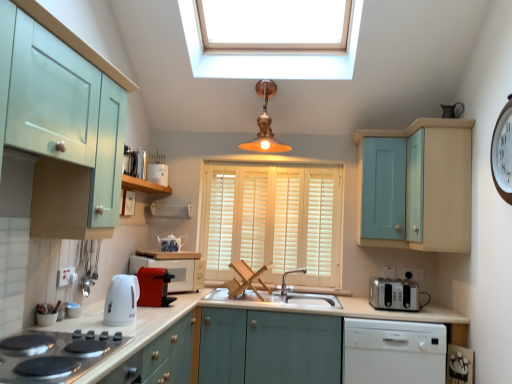
Question: Would you say white ceramic toaster at center, which appears as the second appliance when viewed from the left, is part of light blue wood cabinet at upper right, arranged as the first cabinetry when viewed from the right,'s contents?

Choices:
 (A) yes
 (B) no

Answer: (B)

Question: Considering the relative sizes of light blue wood cabinet at upper right, arranged as the first cabinetry when viewed from the right, and white ceramic toaster at center, the 3th appliance from the bottom, in the image provided, is light blue wood cabinet at upper right, arranged as the first cabinetry when viewed from the right, smaller than white ceramic toaster at center, the 3th appliance from the bottom,?

Choices:
 (A) yes
 (B) no

Answer: (B)

Question: Can you confirm if light blue wood cabinet at upper right, marked as the 3th cabinetry in a left-to-right arrangement, is bigger than white ceramic toaster at center, the 3th appliance from the bottom?

Choices:
 (A) no
 (B) yes

Answer: (B)

Question: From the image's perspective, would you say light blue wood cabinet at upper right, the second cabinetry from the top, is positioned over white ceramic toaster at center, which appears as the second appliance when viewed from the left?

Choices:
 (A) no
 (B) yes

Answer: (A)

Question: From a real-world perspective, is light blue wood cabinet at upper right, which is the second cabinetry in bottom-to-top order, located beneath white ceramic toaster at center, acting as the second appliance starting from the top?

Choices:
 (A) no
 (B) yes

Answer: (B)

Question: Is white glossy electric kettle at lower left inside the boundaries of black glass cooktop at lower left, or outside?

Choices:
 (A) outside
 (B) inside

Answer: (A)

Question: Would you say white glossy electric kettle at lower left is to the left or to the right of black glass cooktop at lower left in the picture?

Choices:
 (A) right
 (B) left

Answer: (A)

Question: In terms of width, does white glossy electric kettle at lower left look wider or thinner when compared to black glass cooktop at lower left?

Choices:
 (A) thin
 (B) wide

Answer: (A)

Question: Is point (125, 319) closer or farther from the camera than point (2, 370)?

Choices:
 (A) farther
 (B) closer

Answer: (A)

Question: Is copper/brass pendant light at center wider or thinner than wooden shelf at upper left?

Choices:
 (A) wide
 (B) thin

Answer: (A)

Question: Is point (289, 147) closer or farther from the camera than point (121, 187)?

Choices:
 (A) closer
 (B) farther

Answer: (B)

Question: In the image, is copper/brass pendant light at center positioned in front of or behind wooden shelf at upper left?

Choices:
 (A) behind
 (B) front

Answer: (A)

Question: Is copper/brass pendant light at center taller or shorter than wooden shelf at upper left?

Choices:
 (A) tall
 (B) short

Answer: (A)

Question: Considering the positions of point (193, 266) and point (292, 271), is point (193, 266) closer or farther from the camera than point (292, 271)?

Choices:
 (A) closer
 (B) farther

Answer: (A)

Question: Is matte red microwave at center, which is counted as the 2th appliance, starting from the right, in front of or behind silver metallic faucet at center in the image?

Choices:
 (A) behind
 (B) front

Answer: (B)